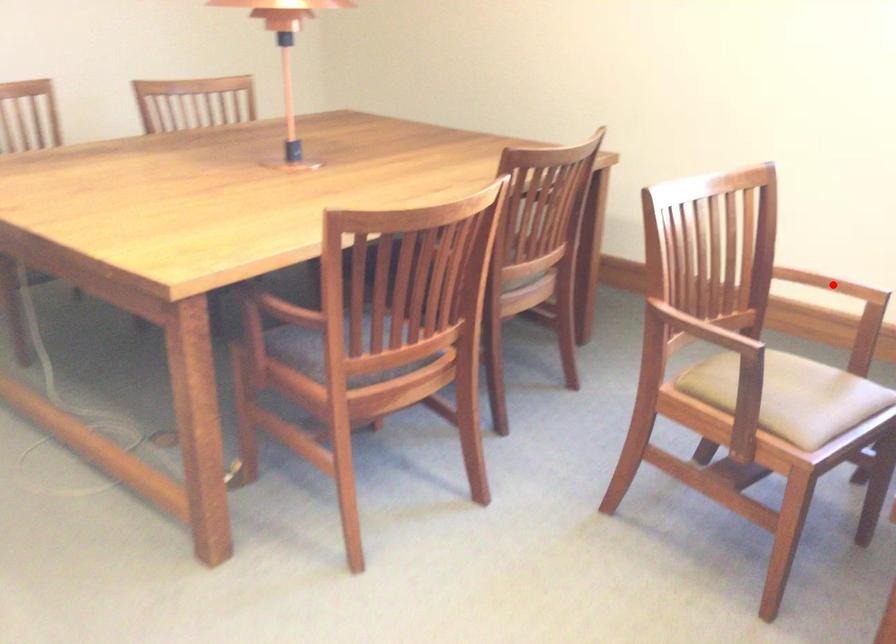
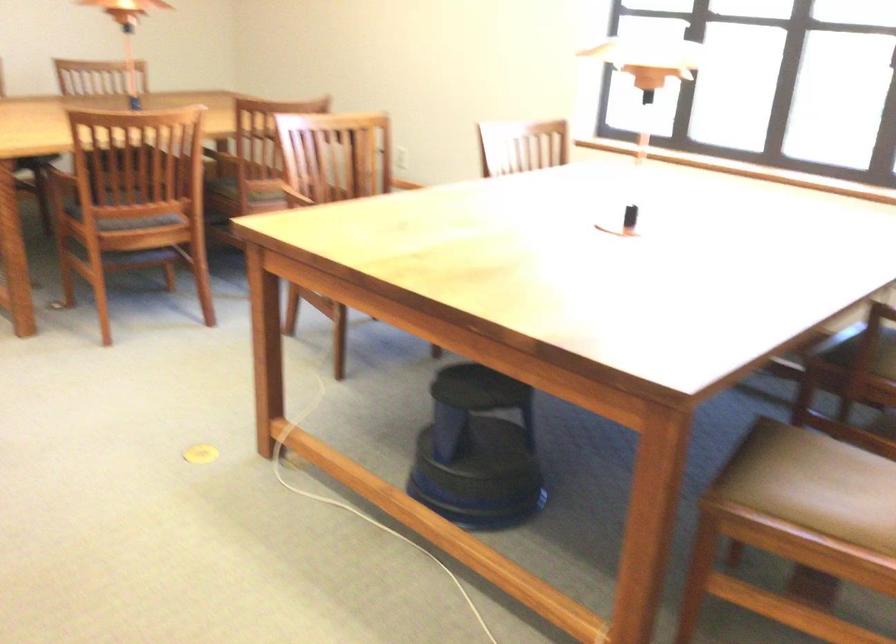
Question: I am providing you with two images of the same scene from different viewpoints. A red point is marked on the first image. At the location where the point appears in image 1, is it still visible in image 2?

Choices:
 (A) Yes
 (B) No

Answer: (B)